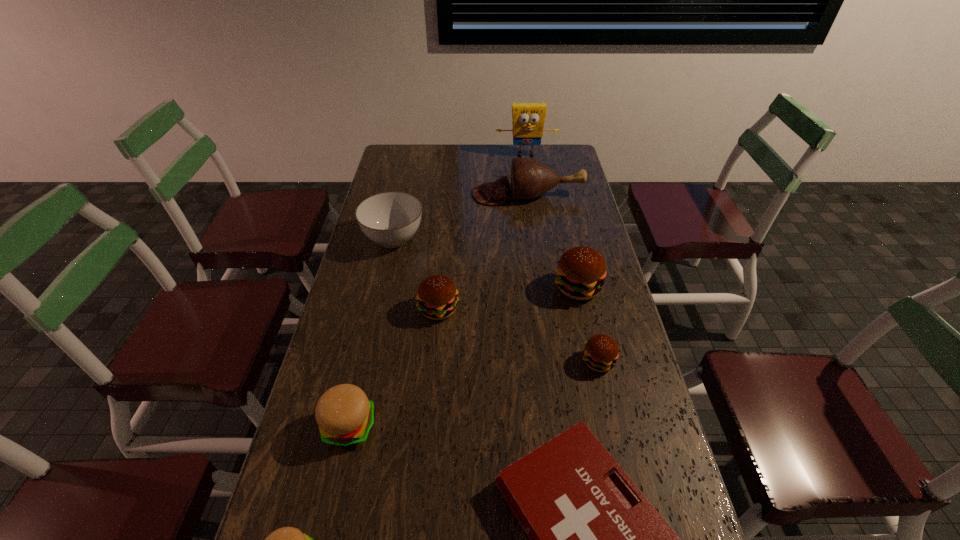
Find the location of a particular element. This screenshot has height=540, width=960. free space located on the left of the nearest brown hamburger is located at coordinates (484, 361).

Identify the location of object at the far edge. This screenshot has width=960, height=540. (528, 119).

At what (x,y) coordinates should I click in order to perform the action: click on chinaware situated at the left edge. Please return your answer as a coordinate pair (x, y). This screenshot has width=960, height=540. Looking at the image, I should click on (390, 219).

Where is `hamburger present at the left edge`? hamburger present at the left edge is located at coordinates (345, 416).

This screenshot has height=540, width=960. I want to click on sponge at the right edge, so click(528, 119).

I want to click on ham at the right edge, so click(530, 179).

Find the location of `object that is at the far right corner`. object that is at the far right corner is located at coordinates (528, 119).

At what (x,y) coordinates should I click in order to perform the action: click on free space at the left edge of the desktop. Please return your answer as a coordinate pair (x, y). This screenshot has width=960, height=540. Looking at the image, I should click on (306, 501).

Locate an element on the screen. The width and height of the screenshot is (960, 540). free location at the right edge is located at coordinates (588, 232).

Where is `free spot at the far left corner of the desktop`? The width and height of the screenshot is (960, 540). free spot at the far left corner of the desktop is located at coordinates (417, 170).